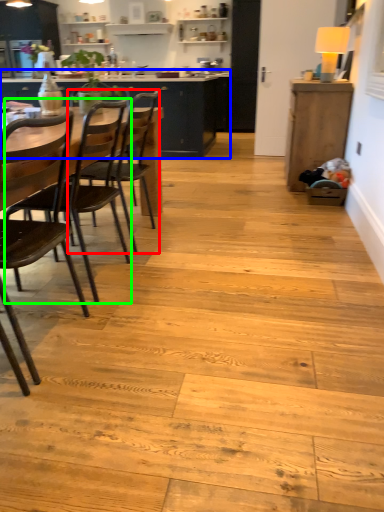
Question: Which object is the farthest from chair (highlighted by a red box)? Choose among these: cabinetry (highlighted by a blue box) or chair (highlighted by a green box).

Choices:
 (A) cabinetry
 (B) chair

Answer: (A)